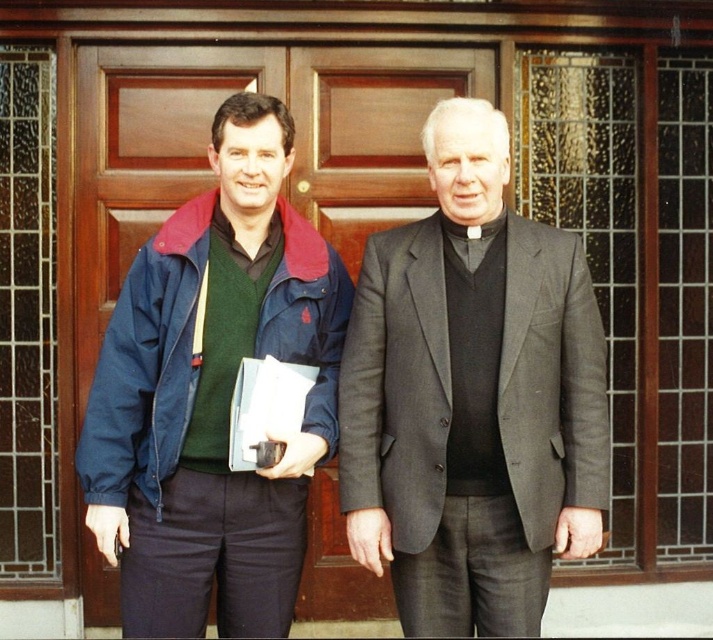
Does navy blue jacket at left have a larger size compared to brown wooden door at left?

Yes, navy blue jacket at left is bigger than brown wooden door at left.

Consider the image. Measure the distance between navy blue jacket at left and camera.

navy blue jacket at left and camera are 3.15 meters apart.

The image size is (713, 640). Find the location of `navy blue jacket at left`. navy blue jacket at left is located at coordinates (352, 397).

Is brown wooden door at center below brown wooden door at left?

Incorrect, brown wooden door at center is not positioned below brown wooden door at left.

Which is in front, point (302, 109) or point (78, 397)?

Point (78, 397) is more forward.

This screenshot has width=713, height=640. I want to click on brown wooden door at center, so click(369, 132).

Between navy blue jacket at left and dark gray suit at center, which one has less height?

Standing shorter between the two is dark gray suit at center.

Does point (188, 420) lie in front of point (528, 368)?

Yes, it is in front of point (528, 368).

I want to click on navy blue jacket at left, so click(352, 397).